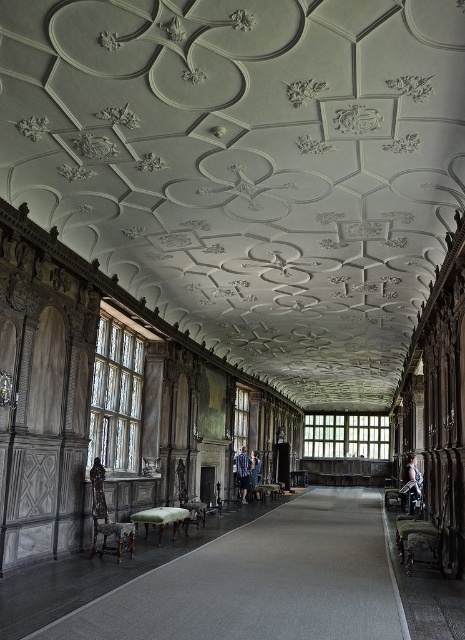
Question: Which object is the farthest from the blue striped shirt at center?

Choices:
 (A) dark brown leather chair at left
 (B) smooth skin figure at center
 (C) blue denim jeans at center

Answer: (A)

Question: Is dark brown leather chair at left wider than smooth skin figure at center?

Choices:
 (A) yes
 (B) no

Answer: (B)

Question: Estimate the real-world distances between objects in this image. Which object is closer to the blue denim jeans at center?

Choices:
 (A) blue striped shirt at center
 (B) dark brown leather chair at left

Answer: (A)

Question: In this image, where is smooth skin figure at center located relative to blue denim jeans at center?

Choices:
 (A) left
 (B) right

Answer: (B)

Question: Among these points, which one is nearest to the camera?

Choices:
 (A) (412, 508)
 (B) (252, 461)
 (C) (101, 484)
 (D) (239, 470)

Answer: (C)

Question: Is smooth skin figure at center to the left of blue denim jeans at center from the viewer's perspective?

Choices:
 (A) no
 (B) yes

Answer: (A)